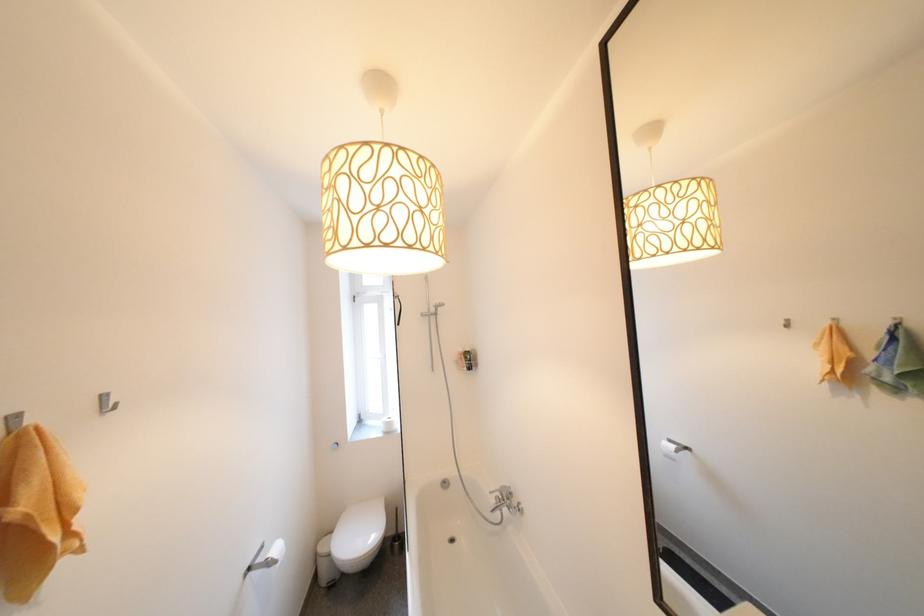
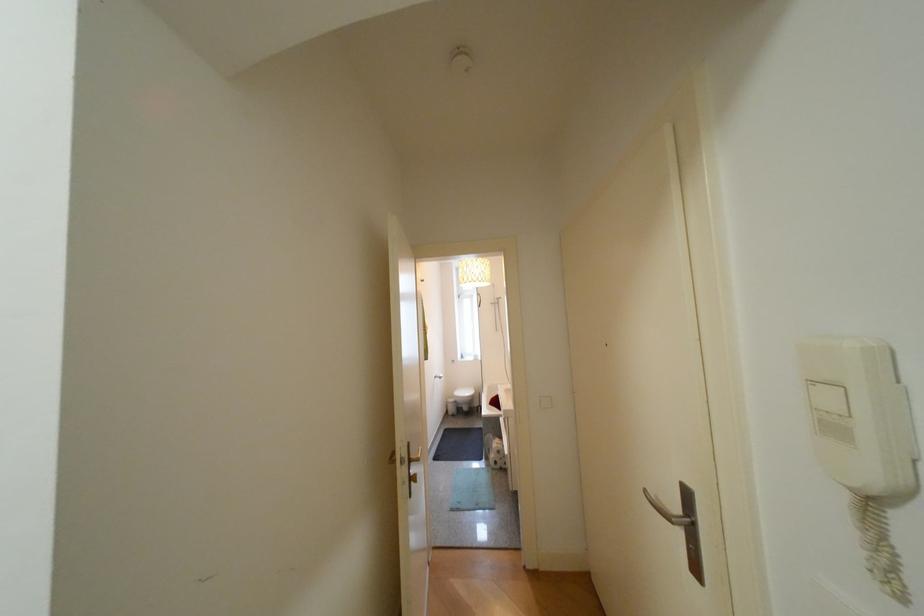
Question: What movement of the cameraman would produce the second image?

Choices:
 (A) Left
 (B) Right
 (C) Forward
 (D) Backward

Answer: (D)